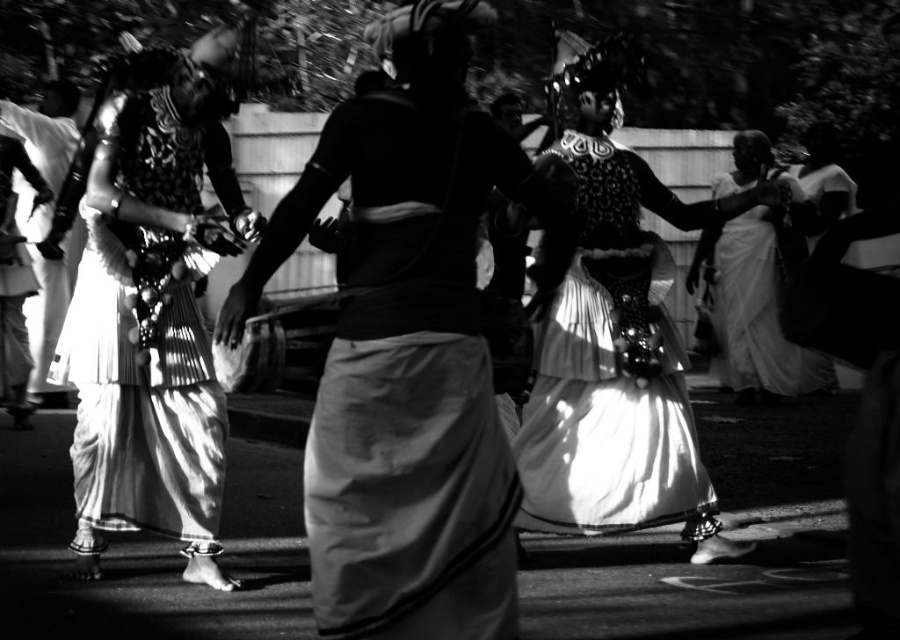
Is shiny white skirt at center wider than white silk dress at center?

Indeed, shiny white skirt at center has a greater width compared to white silk dress at center.

Which is below, shiny white skirt at center or white silk dress at center?

Positioned lower is white silk dress at center.

Does point (742, 205) come closer to viewer compared to point (713, 292)?

Yes, it is.

Where is `shiny white skirt at center`? The image size is (900, 640). shiny white skirt at center is located at coordinates (616, 337).

Is white sheer fabric dress at left wider than white silk dress at center?

No, white sheer fabric dress at left is not wider than white silk dress at center.

Who is more distant from viewer, (141,228) or (757,218)?

The point (757,218) is more distant.

At what (x,y) coordinates should I click in order to perform the action: click on white sheer fabric dress at left. Please return your answer as a coordinate pair (x, y). This screenshot has height=640, width=900. Looking at the image, I should click on (150, 321).

Consider the image. Is white sheer fabric dress at left to the left of shiny white skirt at center from the viewer's perspective?

Correct, you'll find white sheer fabric dress at left to the left of shiny white skirt at center.

Does point (83, 468) come farther from viewer compared to point (608, 188)?

No, (83, 468) is closer to viewer.

Describe the element at coordinates (150, 321) in the screenshot. I see `white sheer fabric dress at left` at that location.

This screenshot has width=900, height=640. What are the coordinates of `white sheer fabric dress at left` in the screenshot? It's located at (150, 321).